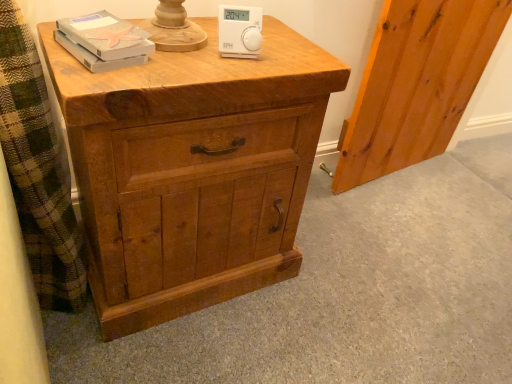
The width and height of the screenshot is (512, 384). What are the coordinates of `vacant area that is in front of natural wood screen door at right` in the screenshot? It's located at (409, 223).